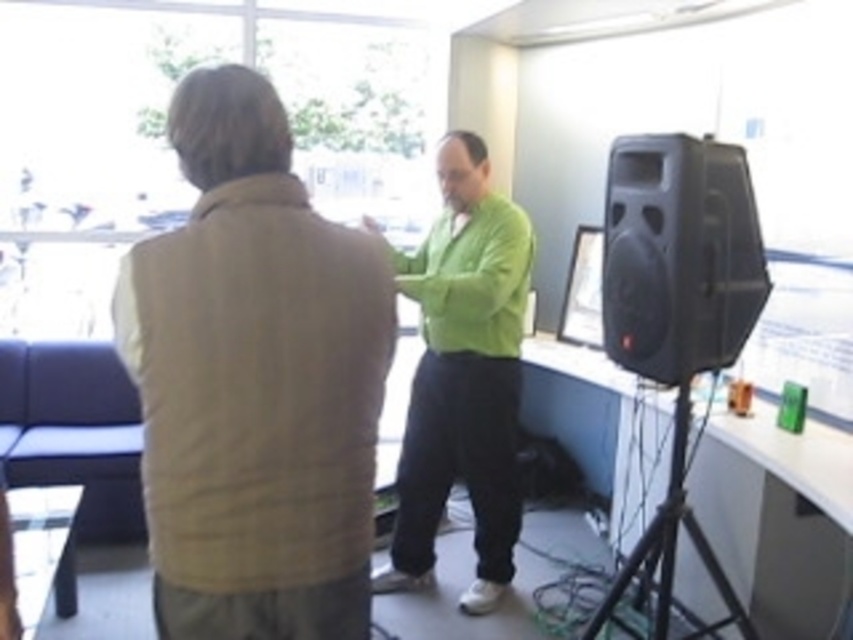
Which is more to the right, green matte sweater at center or matte black speaker at right?

Positioned to the right is matte black speaker at right.

Who is taller, green matte sweater at center or matte black speaker at right?

green matte sweater at center is taller.

Locate an element on the screen. This screenshot has height=640, width=853. green matte sweater at center is located at coordinates (463, 376).

Locate an element on the screen. green matte sweater at center is located at coordinates (463, 376).

Consider the image. Can you confirm if beige woolen vest at upper left is smaller than matte black speaker at right?

Actually, beige woolen vest at upper left might be larger than matte black speaker at right.

Can you confirm if beige woolen vest at upper left is positioned below matte black speaker at right?

Yes.

Who is more forward, (281, 307) or (572, 259)?

Point (281, 307)

This screenshot has width=853, height=640. Identify the location of beige woolen vest at upper left. (254, 381).

Between beige woolen vest at upper left and green matte sweater at center, which one appears on the right side from the viewer's perspective?

From the viewer's perspective, green matte sweater at center appears more on the right side.

Does beige woolen vest at upper left appear under green matte sweater at center?

Actually, beige woolen vest at upper left is above green matte sweater at center.

Identify the location of beige woolen vest at upper left. This screenshot has width=853, height=640. (254, 381).